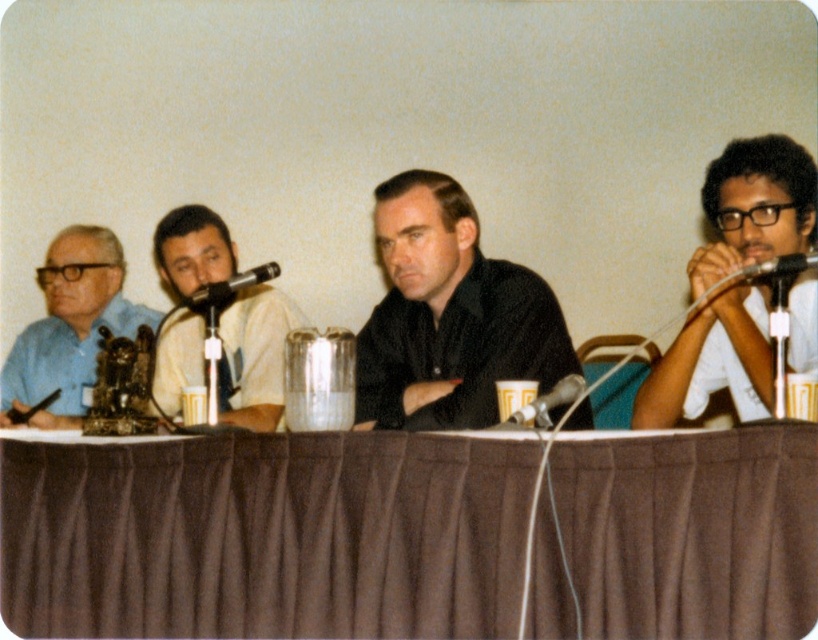
Question: Which point is farther to the camera?

Choices:
 (A) (384, 584)
 (B) (209, 298)
 (C) (554, 401)

Answer: (B)

Question: Is black matte glasses at right further to the viewer compared to matte blue shirt at left?

Choices:
 (A) yes
 (B) no

Answer: (B)

Question: Does black matte glasses at right have a lesser width compared to white matte shirt at center?

Choices:
 (A) yes
 (B) no

Answer: (A)

Question: Can you confirm if brown fabric table at center is bigger than metallic silver microphone at center?

Choices:
 (A) no
 (B) yes

Answer: (B)

Question: Among these objects, which one is nearest to the camera?

Choices:
 (A) brown fabric table at center
 (B) black matte glasses at right

Answer: (A)

Question: Estimate the real-world distances between objects in this image. Which object is closer to the black metallic microphone at center?

Choices:
 (A) metallic silver microphone at upper right
 (B) white matte shirt at center

Answer: (B)